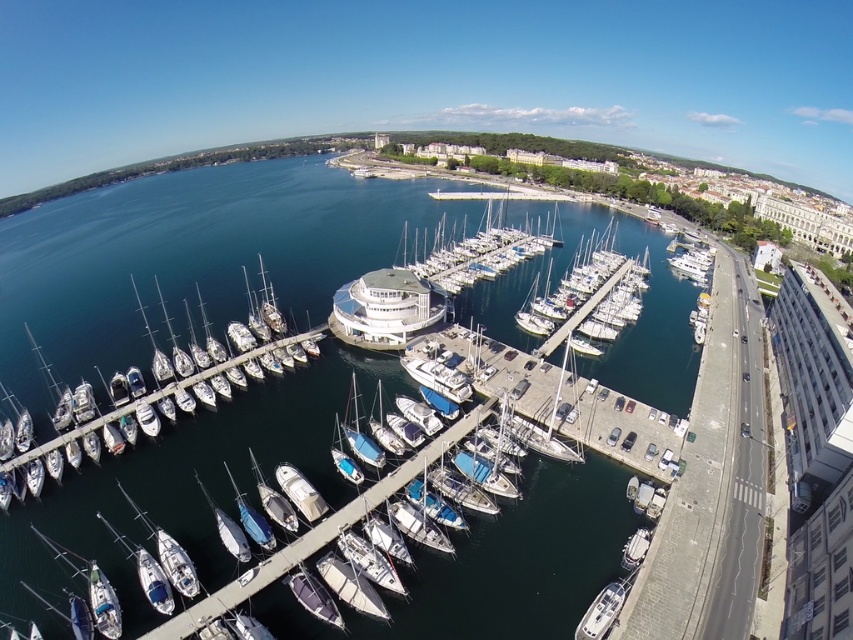
Which is more to the left, dark blue water at center or white glossy sailboat at lower center?

white glossy sailboat at lower center

Between dark blue water at center and white glossy sailboat at lower center, which one has less height?

Standing shorter between the two is white glossy sailboat at lower center.

You are a GUI agent. You are given a task and a screenshot of the screen. Output one action in this format:
    pyautogui.click(x=<x>, y=<y>)
    Task: Click on the dark blue water at center
    This screenshot has height=640, width=853.
    Given the screenshot: What is the action you would take?
    pyautogui.click(x=190, y=259)

You are a GUI agent. You are given a task and a screenshot of the screen. Output one action in this format:
    pyautogui.click(x=<x>, y=<y>)
    Task: Click on the dark blue water at center
    This screenshot has width=853, height=640.
    Given the screenshot: What is the action you would take?
    pyautogui.click(x=190, y=259)